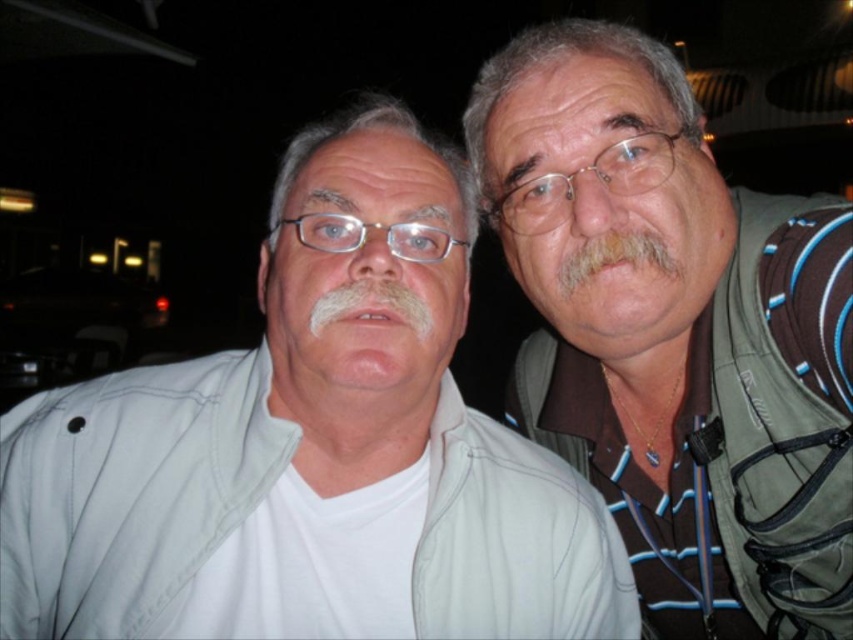
Question: Is green fabric vest at right wider than gray hair at upper right?

Choices:
 (A) yes
 (B) no

Answer: (A)

Question: Which of the following is the closest to the observer?

Choices:
 (A) (418, 321)
 (B) (584, 172)
 (C) (363, 243)

Answer: (A)

Question: Is green fabric vest at right positioned behind white fuzzy beard at center?

Choices:
 (A) no
 (B) yes

Answer: (B)

Question: Which point is closer to the camera?

Choices:
 (A) (187, 531)
 (B) (312, 307)
 (C) (341, 236)
 (D) (779, 458)

Answer: (B)

Question: Which object is farther from the camera taking this photo?

Choices:
 (A) white matte face at center
 (B) gray/soft hair at right
 (C) green fabric vest at right

Answer: (B)

Question: Can you confirm if gray hair at upper right is positioned below clear plastic glasses at upper center?

Choices:
 (A) no
 (B) yes

Answer: (B)